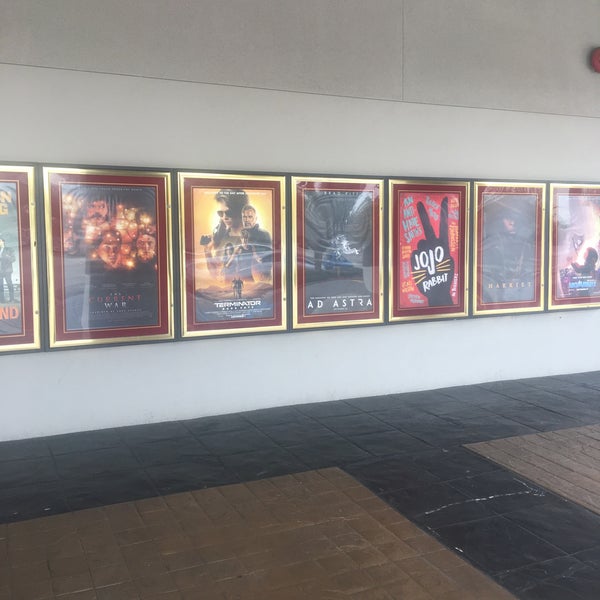
At what (x,y) coordinates should I click in order to perform the action: click on poster. Please return your answer as a coordinate pair (x, y). Looking at the image, I should click on (263, 320).